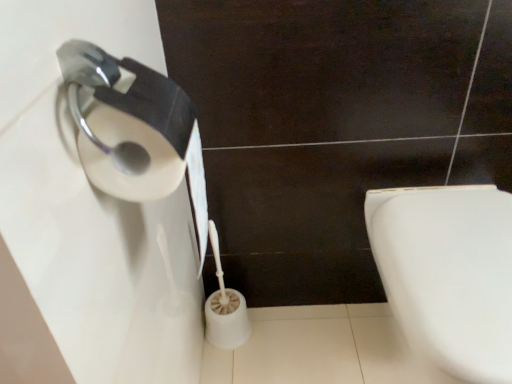
Question: Is white glossy toilet at lower right taller or shorter than white matte toilet paper at lower center?

Choices:
 (A) tall
 (B) short

Answer: (B)

Question: Is point (506, 304) closer or farther from the camera than point (214, 329)?

Choices:
 (A) farther
 (B) closer

Answer: (B)

Question: Which is correct: white glossy toilet at lower right is inside white matte toilet paper at lower center, or outside of it?

Choices:
 (A) inside
 (B) outside

Answer: (B)

Question: From the image's perspective, is white matte toilet paper at lower center positioned above or below white glossy toilet at lower right?

Choices:
 (A) above
 (B) below

Answer: (A)

Question: Is white matte toilet paper at lower center situated inside white glossy toilet at lower right or outside?

Choices:
 (A) outside
 (B) inside

Answer: (A)

Question: Looking at the image, does white matte toilet paper at lower center seem bigger or smaller compared to white glossy toilet at lower right?

Choices:
 (A) big
 (B) small

Answer: (B)

Question: Considering the positions of point (229, 311) and point (403, 286), is point (229, 311) closer or farther from the camera than point (403, 286)?

Choices:
 (A) farther
 (B) closer

Answer: (A)